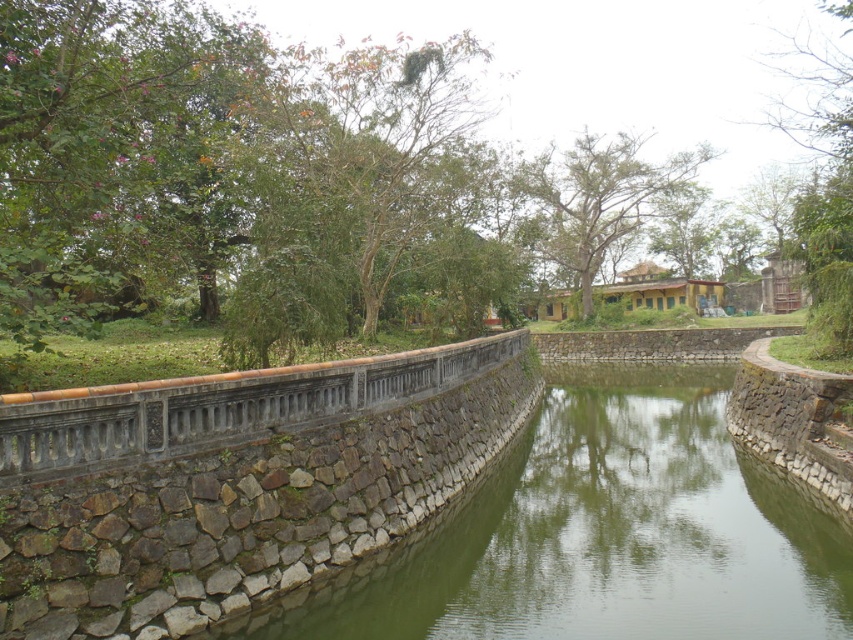
How much distance is there between green leafy tree at upper left and green leafy tree at center?

A distance of 98.83 feet exists between green leafy tree at upper left and green leafy tree at center.

Is green leafy tree at upper left shorter than green leafy tree at center?

A: Correct, green leafy tree at upper left is not as tall as green leafy tree at center.

What do you see at coordinates (351, 188) in the screenshot? This screenshot has width=853, height=640. I see `green leafy tree at upper left` at bounding box center [351, 188].

This screenshot has height=640, width=853. What are the coordinates of `green leafy tree at upper left` in the screenshot? It's located at (351, 188).

Which is above, green leafy tree at upper center or green leafy tree at upper right?

Positioned higher is green leafy tree at upper center.

Is green leafy tree at upper center to the left of green leafy tree at upper right from the viewer's perspective?

Indeed, green leafy tree at upper center is positioned on the left side of green leafy tree at upper right.

The height and width of the screenshot is (640, 853). I want to click on green leafy tree at upper center, so click(x=354, y=186).

Locate an element on the screen. The width and height of the screenshot is (853, 640). green leafy tree at upper center is located at coordinates (354, 186).

Is brown stone bridge at center behind green leafy tree at upper right?

No, it is not.

In order to click on brown stone bridge at center in this screenshot , I will do `click(222, 406)`.

Who is more forward, (375, 369) or (822, 147)?

Positioned in front is point (375, 369).

This screenshot has height=640, width=853. I want to click on brown stone bridge at center, so click(222, 406).